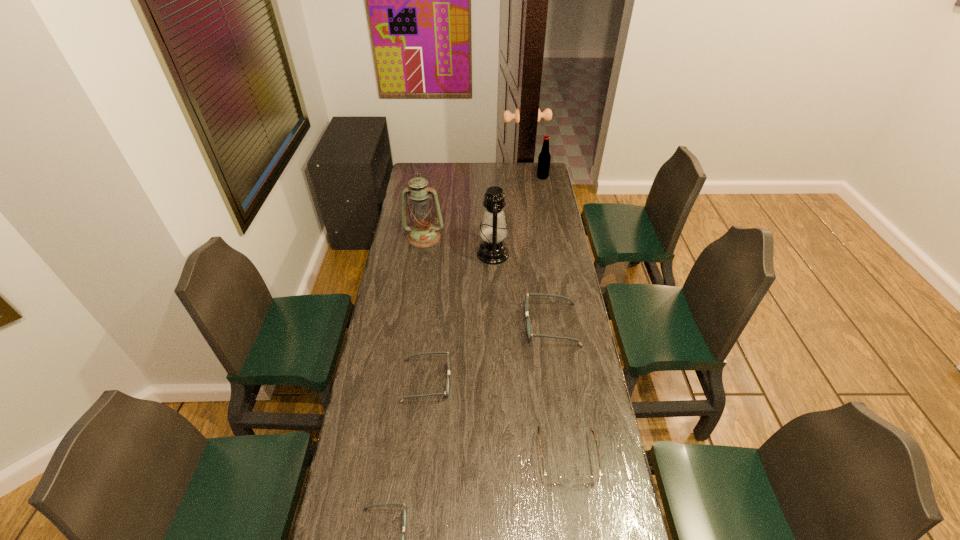
Find the location of a particular element. the fourth object from right to left is located at coordinates (493, 229).

Find the location of `black oil lamp`. black oil lamp is located at coordinates (493, 229).

Find the location of a particular element. Image resolution: width=960 pixels, height=540 pixels. the left oil lamp is located at coordinates (423, 234).

Locate an element on the screen. beer bottle is located at coordinates (544, 158).

Locate an element on the screen. the fifth shortest object is located at coordinates (544, 158).

You are a GUI agent. You are given a task and a screenshot of the screen. Output one action in this format:
    pyautogui.click(x=<x>, y=<y>)
    Task: Click on the tallest spectacles
    This screenshot has height=540, width=960.
    Given the screenshot: What is the action you would take?
    pyautogui.click(x=528, y=323)

Locate an element on the screen. This screenshot has width=960, height=540. the rightmost gray spectacles is located at coordinates (528, 323).

Identify the location of the second biggest gray spectacles. (446, 392).

Locate an element on the screen. This screenshot has width=960, height=540. the third nearest object is located at coordinates (446, 392).

The width and height of the screenshot is (960, 540). In order to click on the second nearest spectacles in this screenshot , I will do `click(555, 480)`.